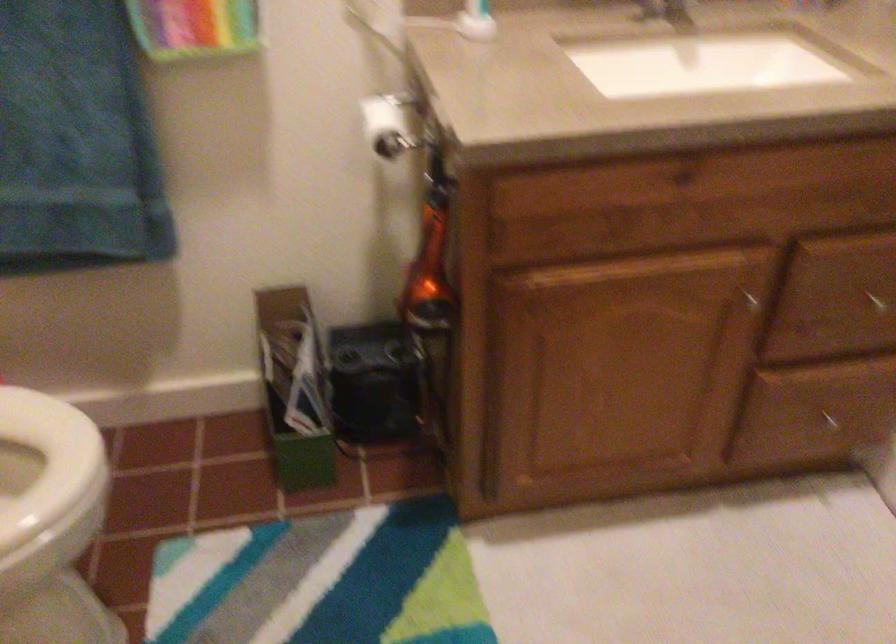
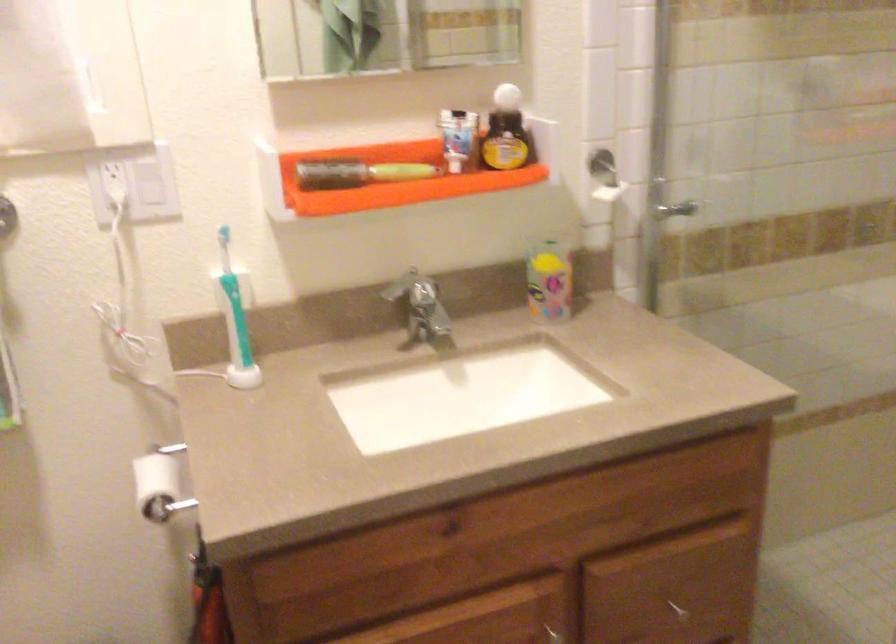
The point at (750, 308) is marked in the first image. Where is the corresponding point in the second image?

(555, 635)